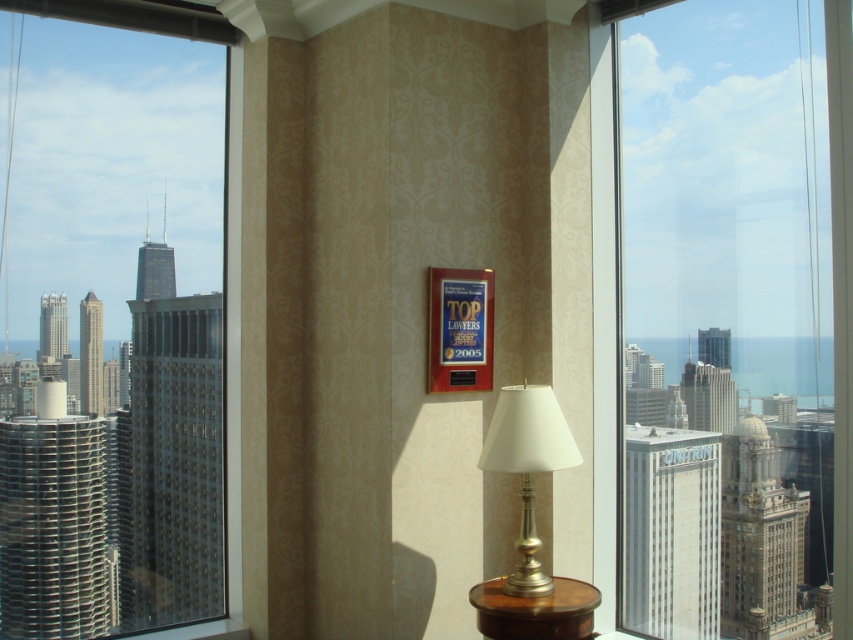
Question: Does silver metallic lamp at center have a greater width compared to brown wood table at lower center?

Choices:
 (A) yes
 (B) no

Answer: (B)

Question: Among these points, which one is farthest from the camera?

Choices:
 (A) (527, 634)
 (B) (538, 396)
 (C) (616, 285)
 (D) (157, 401)

Answer: (D)

Question: Which point is farther to the camera?

Choices:
 (A) click(843, 180)
 (B) click(560, 611)
 (C) click(6, 628)

Answer: (C)

Question: Is transparent glass window at left above silver metallic lamp at center?

Choices:
 (A) no
 (B) yes

Answer: (B)

Question: Which point is closer to the camera?

Choices:
 (A) (614, 205)
 (B) (206, 611)
 (C) (524, 422)
 (D) (564, 612)

Answer: (D)

Question: Does silver metallic lamp at center come in front of brown wood table at lower center?

Choices:
 (A) no
 (B) yes

Answer: (A)